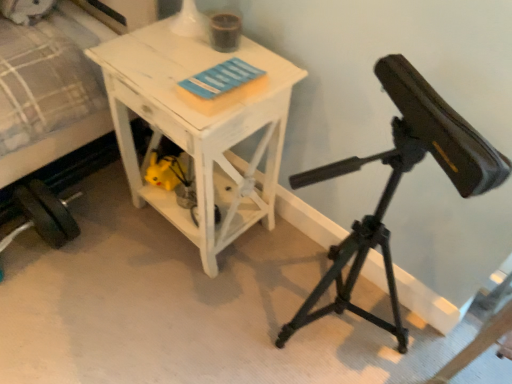
Locate an element on the screen. The height and width of the screenshot is (384, 512). space that is in front of white distressed wood table at center is located at coordinates (170, 313).